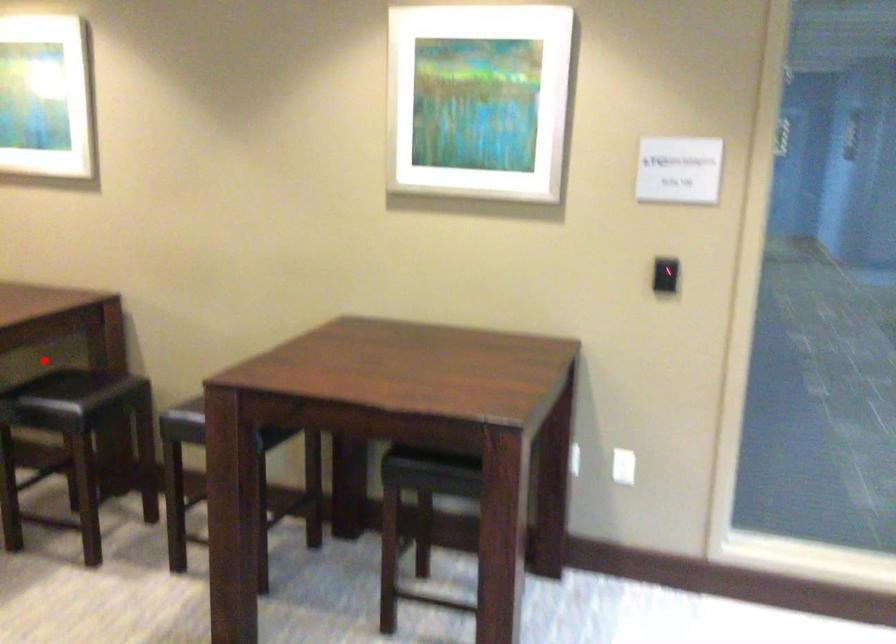
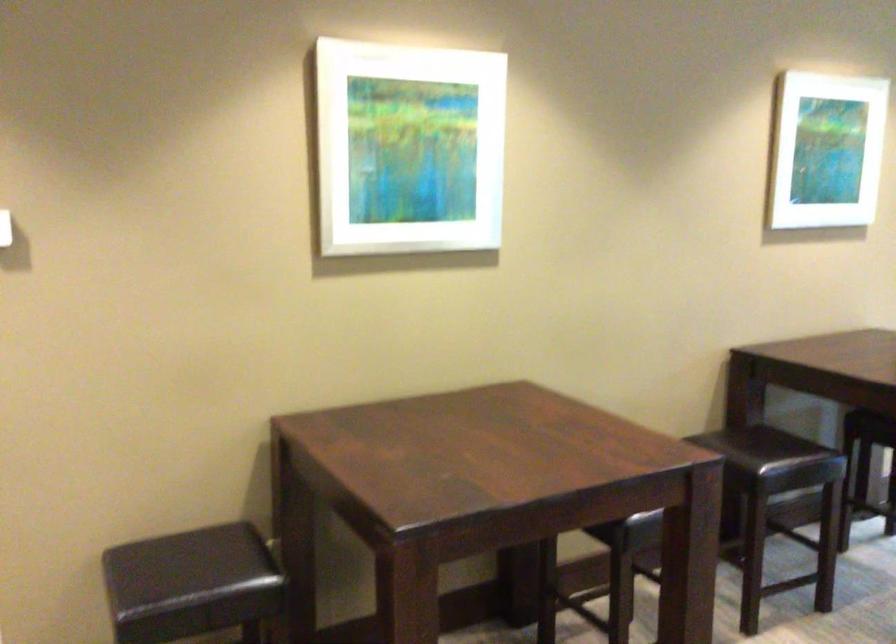
Question: I am providing you with two images of the same scene from different viewpoints. A red point is marked on the first image. At the location where the point appears in image 1, is it still visible in image 2?

Choices:
 (A) Yes
 (B) No

Answer: (B)